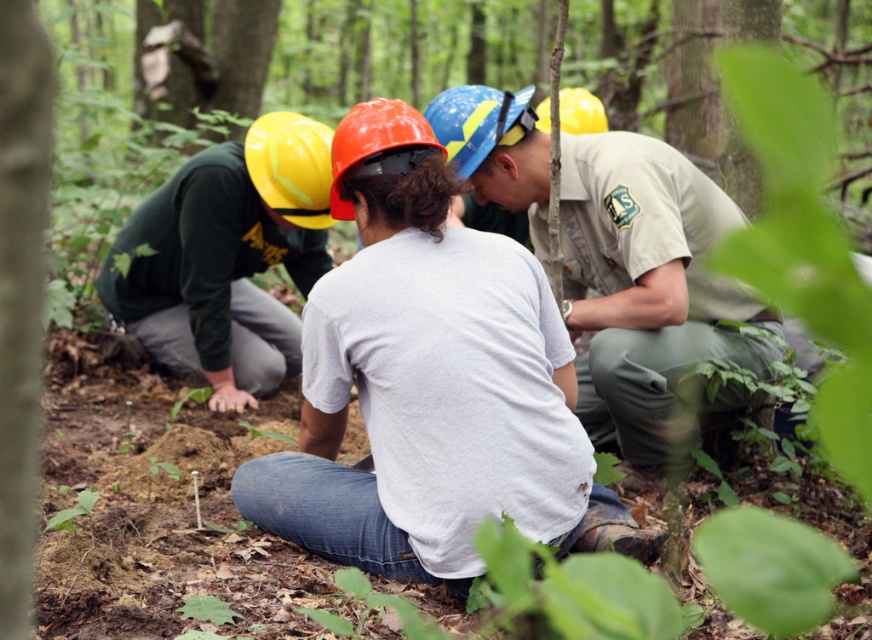
Question: Observing the image, what is the correct spatial positioning of orange matte helmet at center in reference to yellow matte helmet at upper right?

Choices:
 (A) above
 (B) below

Answer: (B)

Question: Does matte green shirt at left have a smaller size compared to yellow hard hat at upper left?

Choices:
 (A) no
 (B) yes

Answer: (A)

Question: Which point is farther to the camera?

Choices:
 (A) (35, 392)
 (B) (336, 198)

Answer: (B)

Question: Which of the following is the closest to the observer?

Choices:
 (A) (379, 227)
 (B) (152, 330)
 (C) (441, 96)

Answer: (A)

Question: Which object is positioned farthest from the matte green shirt at left?

Choices:
 (A) orange matte helmet at center
 (B) khaki uniform at center
 (C) smooth bark tree at left

Answer: (A)

Question: Can you confirm if khaki uniform at center is positioned to the left of yellow hard hat at upper left?

Choices:
 (A) no
 (B) yes

Answer: (A)